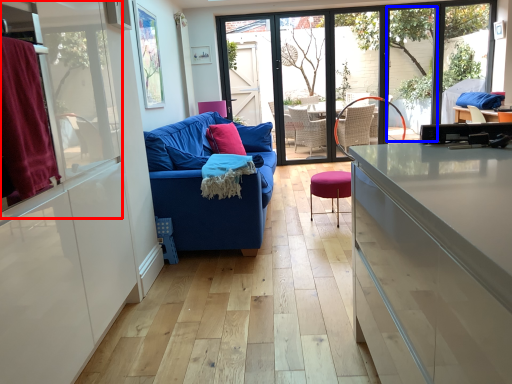
Question: Which object appears farthest to the camera in this image, window screen (highlighted by a red box) or window (highlighted by a blue box)?

Choices:
 (A) window screen
 (B) window

Answer: (B)